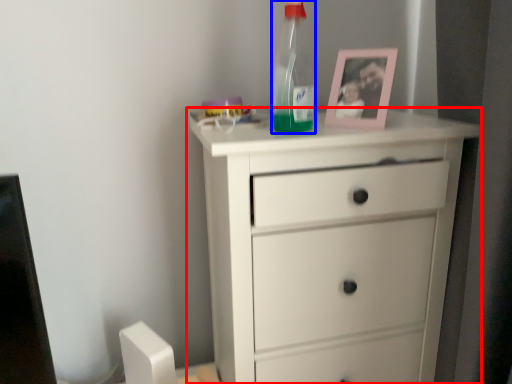
Question: Which of the following is the farthest to the observer, chest of drawers (highlighted by a red box) or bottle (highlighted by a blue box)?

Choices:
 (A) chest of drawers
 (B) bottle

Answer: (B)